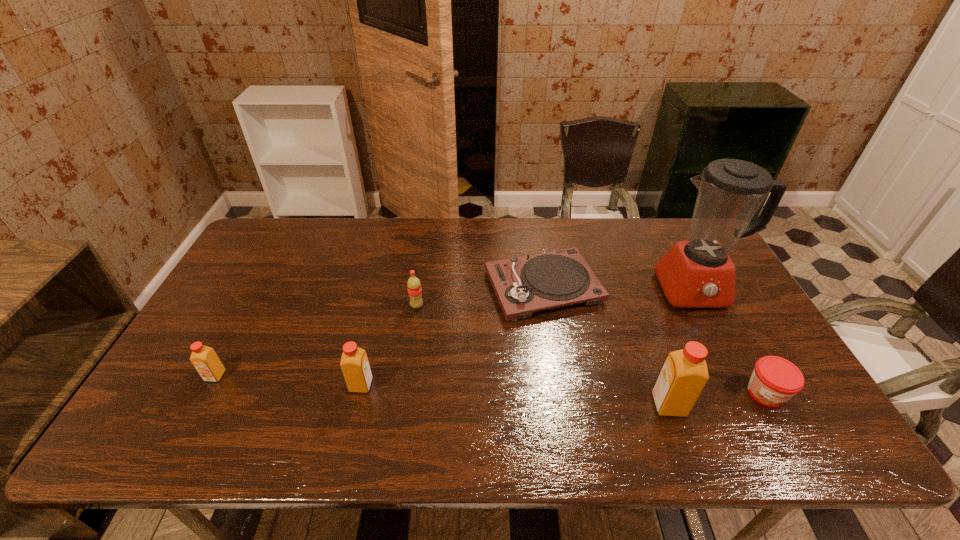
Find the location of `jam located in the near edge section of the desktop`. jam located in the near edge section of the desktop is located at coordinates (775, 380).

This screenshot has height=540, width=960. What are the coordinates of `object that is positioned at the left edge` in the screenshot? It's located at (205, 360).

Where is `blender located at the right edge`? The width and height of the screenshot is (960, 540). blender located at the right edge is located at coordinates (698, 273).

At what (x,y) coordinates should I click in order to perform the action: click on jam that is at the right edge. Please return your answer as a coordinate pair (x, y). Looking at the image, I should click on (775, 380).

Locate an element on the screen. object present at the near left corner is located at coordinates (205, 360).

You are a GUI agent. You are given a task and a screenshot of the screen. Output one action in this format:
    pyautogui.click(x=<x>, y=<y>)
    Task: Click on the object present at the near right corner
    The width and height of the screenshot is (960, 540).
    Given the screenshot: What is the action you would take?
    pyautogui.click(x=775, y=380)

Find the location of a particular element. Image resolution: width=960 pixels, height=540 pixels. vacant space at the far edge is located at coordinates (320, 236).

At what (x,y) coordinates should I click in order to perform the action: click on vacant space at the near edge of the desktop. Please return your answer as a coordinate pair (x, y). Looking at the image, I should click on (327, 384).

You are a GUI agent. You are given a task and a screenshot of the screen. Output one action in this format:
    pyautogui.click(x=<x>, y=<y>)
    Task: Click on the vacant area at the left edge
    
    Given the screenshot: What is the action you would take?
    pyautogui.click(x=227, y=287)

In the image, there is a desktop. Where is `vacant space at the right edge`? The image size is (960, 540). vacant space at the right edge is located at coordinates (718, 342).